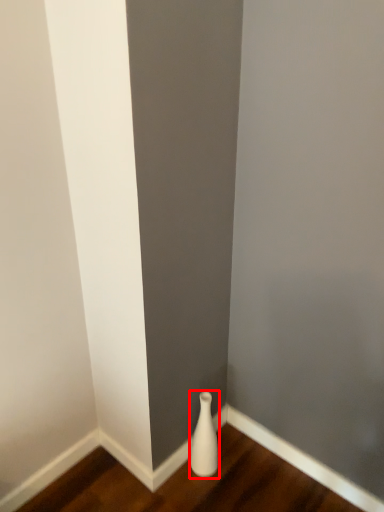
Question: From the image's perspective, where is vase (annotated by the red box) located relative to hardwood?

Choices:
 (A) above
 (B) below

Answer: (A)